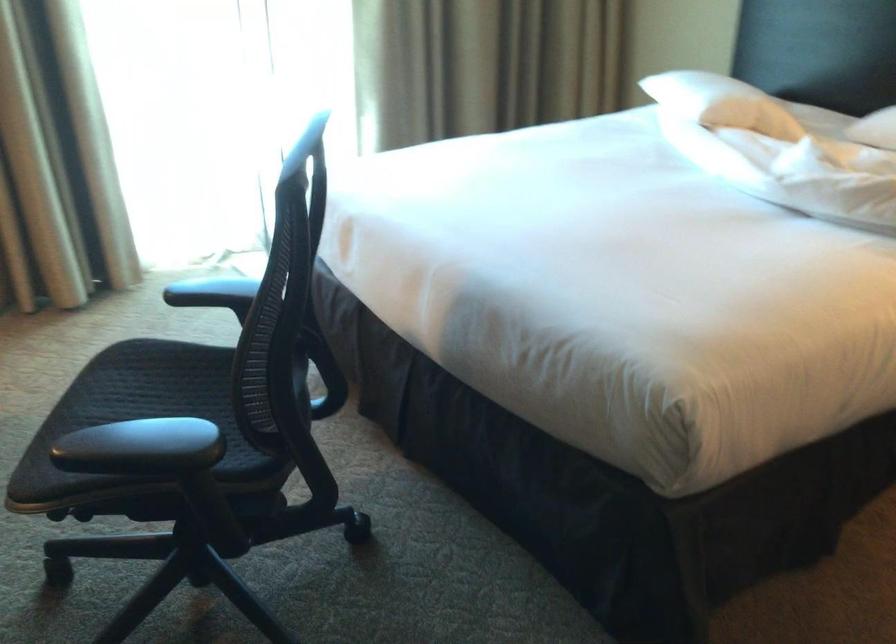
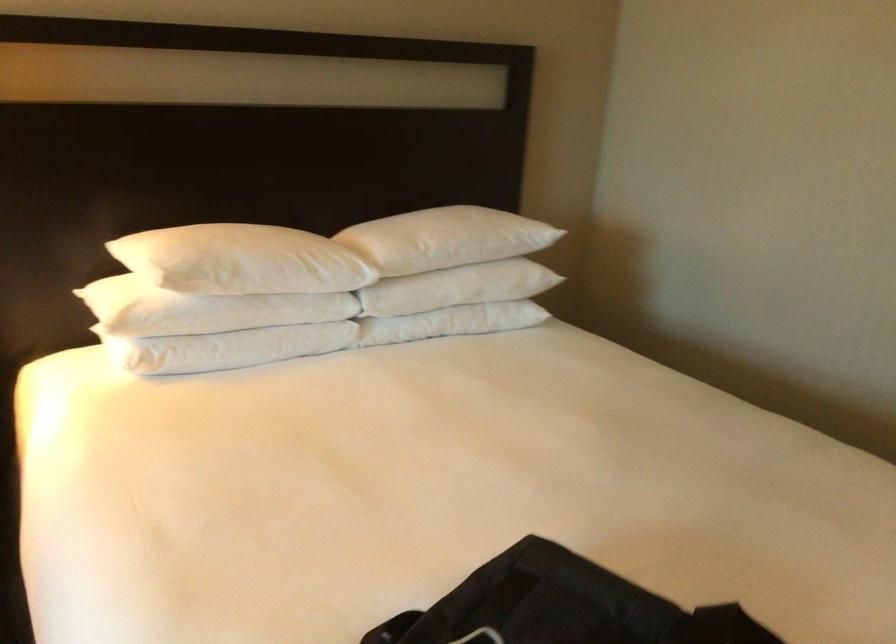
Question: The camera is either moving clockwise (left) or counter-clockwise (right) around the object. The first image is from the beginning of the video and the second image is from the end. Is the camera moving left or right when shooting the video?

Choices:
 (A) Left
 (B) Right

Answer: (A)